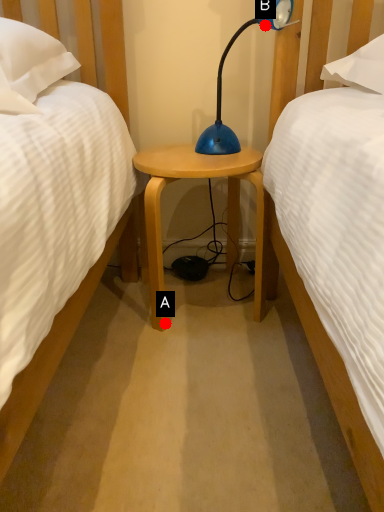
Question: Two points are circled on the image, labeled by A and B beside each circle. Which point is farther from the camera taking this photo?

Choices:
 (A) A is further
 (B) B is further

Answer: (B)